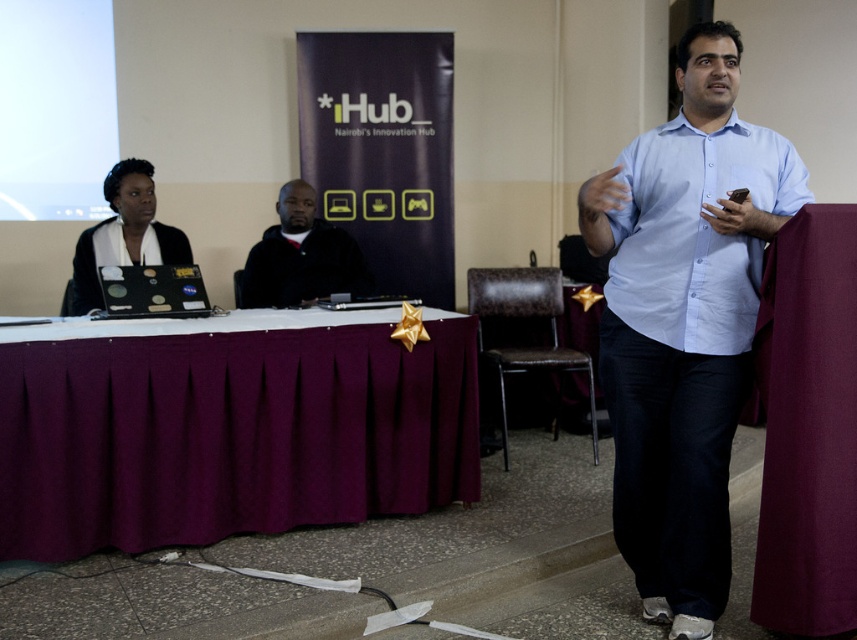
Is maroon fabric table at center wider than light blue button-down shirt at center?

Indeed, maroon fabric table at center has a greater width compared to light blue button-down shirt at center.

This screenshot has height=640, width=857. What do you see at coordinates (228, 428) in the screenshot? I see `maroon fabric table at center` at bounding box center [228, 428].

Which is behind, point (265, 472) or point (744, 225)?

Positioned behind is point (265, 472).

In order to click on maroon fabric table at center in this screenshot , I will do `click(228, 428)`.

Can you confirm if maroon fabric table at center is positioned to the left of matte black laptop at left?

No, maroon fabric table at center is not to the left of matte black laptop at left.

Can you confirm if maroon fabric table at center is positioned to the right of matte black laptop at left?

Indeed, maroon fabric table at center is positioned on the right side of matte black laptop at left.

Does point (424, 499) come farther from viewer compared to point (108, 179)?

No, (424, 499) is closer to viewer.

Where is `maroon fabric table at center`? maroon fabric table at center is located at coordinates (228, 428).

Consider the image. Between light blue button-down shirt at center and black matte jacket at center, which one has more height?

Standing taller between the two is light blue button-down shirt at center.

From the picture: Is light blue button-down shirt at center positioned in front of black matte jacket at center?

That is True.

Is point (748, 154) less distant than point (322, 234)?

That is True.

Locate an element on the screen. light blue button-down shirt at center is located at coordinates (684, 323).